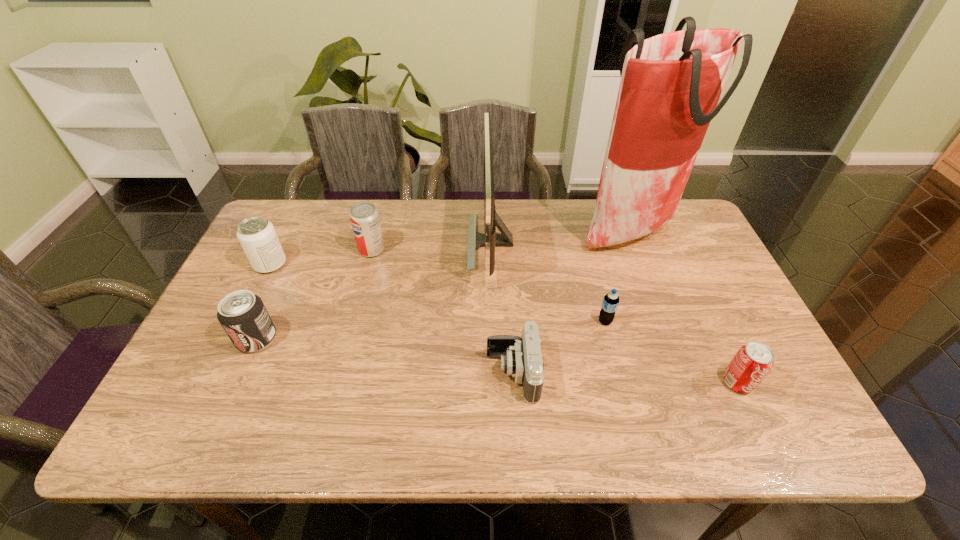
Where is `vacant space that is in between the nearest soda bottle and the third object from left to right`? vacant space that is in between the nearest soda bottle and the third object from left to right is located at coordinates (555, 316).

At what (x,y) coordinates should I click in order to perform the action: click on free spot between the tallest object and the rightmost soda bottle. Please return your answer as a coordinate pair (x, y). The height and width of the screenshot is (540, 960). Looking at the image, I should click on (684, 306).

You are a GUI agent. You are given a task and a screenshot of the screen. Output one action in this format:
    pyautogui.click(x=<x>, y=<y>)
    Task: Click on the vacant space that's between the camera and the monitor
    The image size is (960, 540).
    Given the screenshot: What is the action you would take?
    pyautogui.click(x=502, y=308)

Identify which object is the second nearest to the grocery bag. Please provide its 2D coordinates. Your answer should be formatted as a tuple, i.e. [(x, y)], where the tuple contains the x and y coordinates of a point satisfying the conditions above.

[(610, 303)]

Select which object is the fourth closest to the nearest soda bottle. Please provide its 2D coordinates. Your answer should be formatted as a tuple, i.e. [(x, y)], where the tuple contains the x and y coordinates of a point satisfying the conditions above.

[(489, 240)]

The image size is (960, 540). Identify the location of soda bottle that is the fourth closest to the fourth soda bottle from left to right. (257, 236).

Find the location of a particular element. soda bottle that is the third closest to the tallest object is located at coordinates (364, 217).

You are a GUI agent. You are given a task and a screenshot of the screen. Output one action in this format:
    pyautogui.click(x=<x>, y=<y>)
    Task: Click on the vacant space that satisfies the following two spatial constraints: 1. on the front side of the second soda bottle from right to left; 2. at the front of the camera with an open lens cover
    Image resolution: width=960 pixels, height=540 pixels.
    Given the screenshot: What is the action you would take?
    pyautogui.click(x=618, y=373)

Find the location of a particular element. This screenshot has width=960, height=540. free spot that satisfies the following two spatial constraints: 1. on the screen side of the monitor; 2. on the right side of the second soda bottle from right to left is located at coordinates (492, 321).

Image resolution: width=960 pixels, height=540 pixels. I want to click on free location that satisfies the following two spatial constraints: 1. on the back side of the fourth soda bottle from left to right; 2. on the screen side of the seventh shortest object, so click(x=585, y=242).